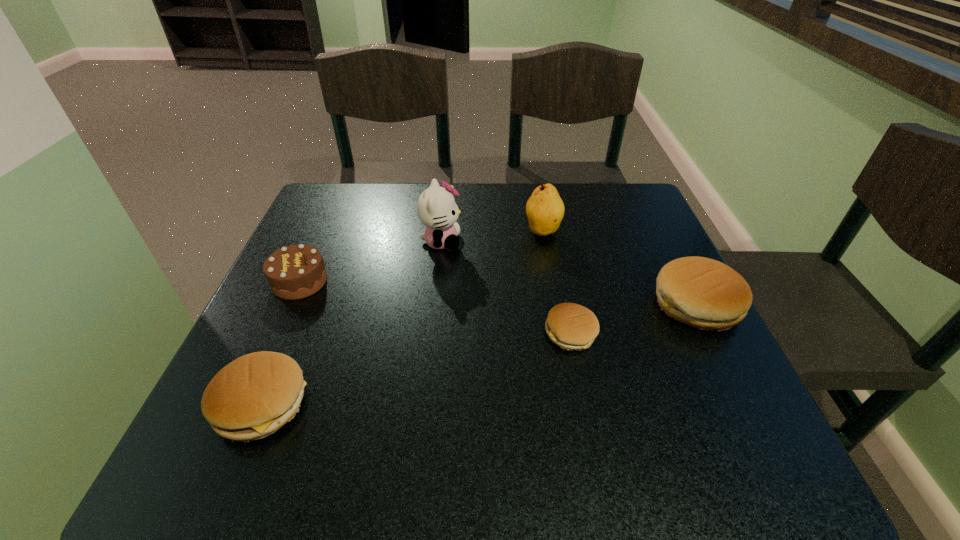
Where is `free space for an extra patty_(food) to achieve even spacing`? The height and width of the screenshot is (540, 960). free space for an extra patty_(food) to achieve even spacing is located at coordinates (427, 366).